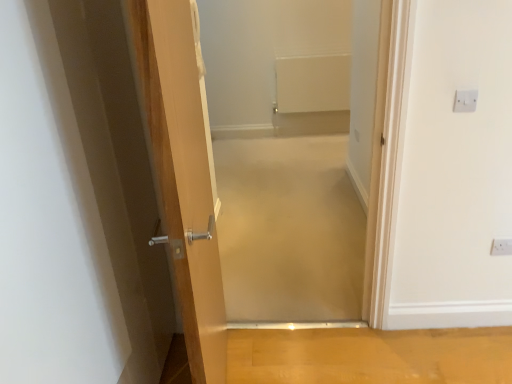
Locate an element on the screen. vacant region above beige carpet at center, which appears as the 2th corridor when viewed from the front (from a real-world perspective) is located at coordinates (286, 181).